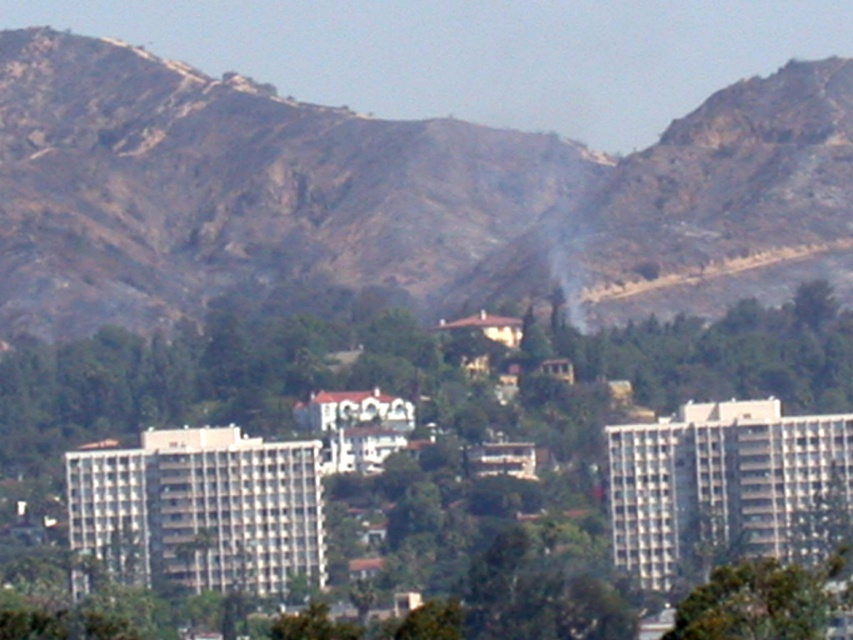
Question: Which of the following is the farthest from the observer?

Choices:
 (A) (199, 412)
 (B) (772, 580)

Answer: (B)

Question: Based on their relative distances, which object is farther from the brown rocky mountain at center?

Choices:
 (A) green leafy tree at center
 (B) green leafy tree at lower right

Answer: (B)

Question: Is brown rocky mountain at center positioned in front of green leafy tree at lower right?

Choices:
 (A) no
 (B) yes

Answer: (B)

Question: Which object is closer to the camera taking this photo?

Choices:
 (A) green leafy tree at center
 (B) brown rocky mountain at center
 (C) green leafy tree at lower right

Answer: (B)

Question: Can you confirm if brown rocky mountain at center is thinner than green leafy tree at center?

Choices:
 (A) yes
 (B) no

Answer: (B)

Question: Is brown rocky mountain at center positioned at the back of green leafy tree at lower right?

Choices:
 (A) no
 (B) yes

Answer: (A)